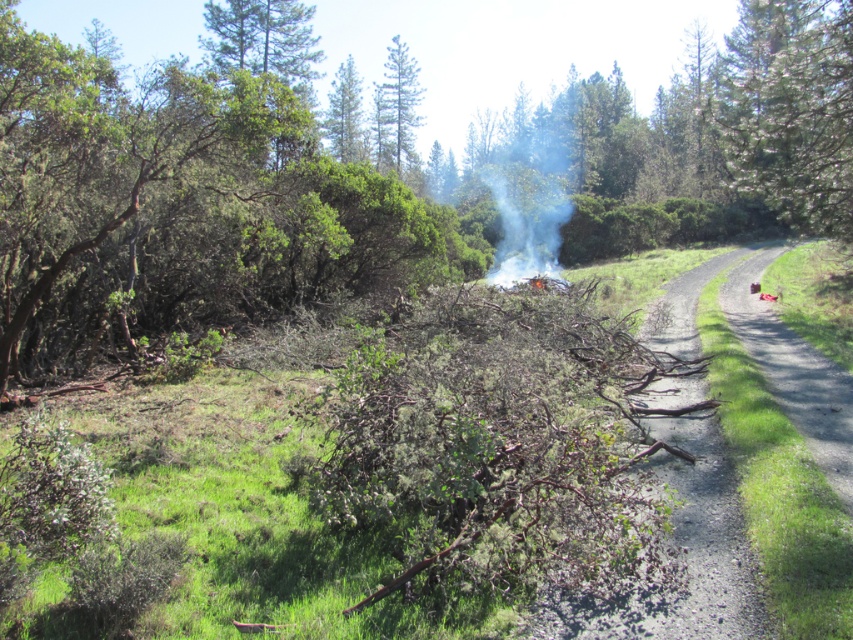
In the scene shown: Between green textured pine tree at right and green leafy tree at upper center, which one appears on the right side from the viewer's perspective?

Positioned to the right is green textured pine tree at right.

Does green textured pine tree at right appear on the left side of green leafy tree at upper center?

No, green textured pine tree at right is not to the left of green leafy tree at upper center.

The image size is (853, 640). I want to click on green textured pine tree at right, so click(791, 109).

Image resolution: width=853 pixels, height=640 pixels. What are the coordinates of `green textured pine tree at right` in the screenshot? It's located at (791, 109).

Does gravelly dirt road at center-right appear on the left side of white smoke at center?

Indeed, gravelly dirt road at center-right is positioned on the left side of white smoke at center.

Can you confirm if gravelly dirt road at center-right is shorter than white smoke at center?

Yes.

This screenshot has height=640, width=853. What are the coordinates of `gravelly dirt road at center-right` in the screenshot? It's located at (683, 556).

Is point (683, 435) less distant than point (778, 198)?

Yes, point (683, 435) is in front of point (778, 198).

Can you confirm if gravelly dirt road at center-right is positioned to the left of green textured pine tree at right?

Correct, you'll find gravelly dirt road at center-right to the left of green textured pine tree at right.

Is point (688, 502) behind point (724, 48)?

No, it is in front of (724, 48).

Find the location of a particular element. The width and height of the screenshot is (853, 640). gravelly dirt road at center-right is located at coordinates (683, 556).